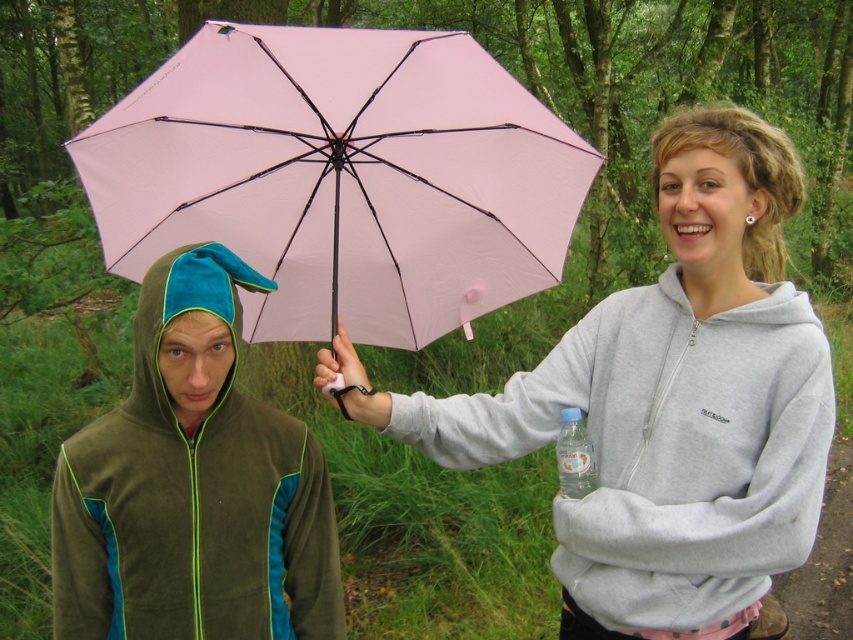
You are standing in a forest and want to reach a specific point marked at coordinates point [674,301]. If you can walk 2 meters in 1 minute, how long will it take you to reach that point?

The distance of point [674,301] from camera is 1.69 meters. Since you can walk 2 meters in 1 minute, it will take approximately 50 seconds to reach the point.

You are a photographer trying to capture a closeup shot of the clear plastic bottle at lower center while keeping the olive fleece jacket at left in the frame. Based on their current positions, can you fit both into your camera viewfinder without moving either subject?

The olive fleece jacket at left and clear plastic bottle at lower center are 27.08 inches apart. Since the distance between them is relatively small, it should be possible to frame both subjects within the camera viewfinder without needing to move either.